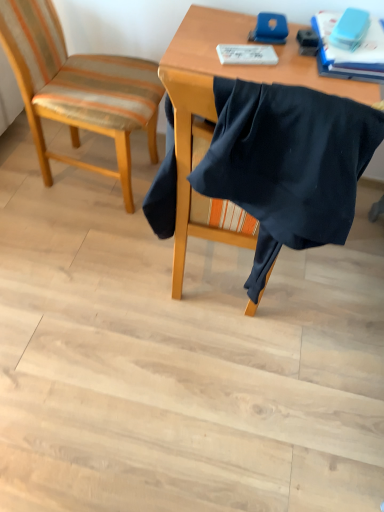
Identify the location of free area below striped fabric chair at left, placed as the 2th chair when sorted from right to left (from a real-world perspective). The width and height of the screenshot is (384, 512). (87, 175).